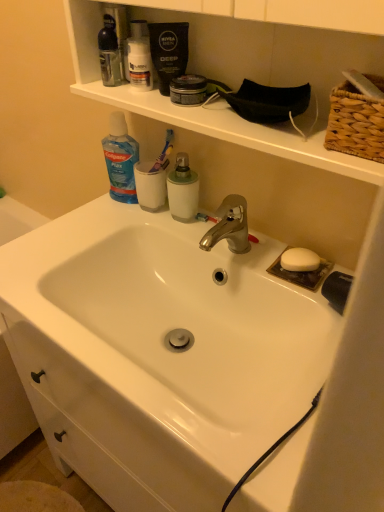
At what (x,y) coordinates should I click in order to perform the action: click on space that is in front of purple plastic toothbrush at upper center, which is the first toothbrush in left-to-right order. Please return your answer as a coordinate pair (x, y). Looking at the image, I should click on (167, 221).